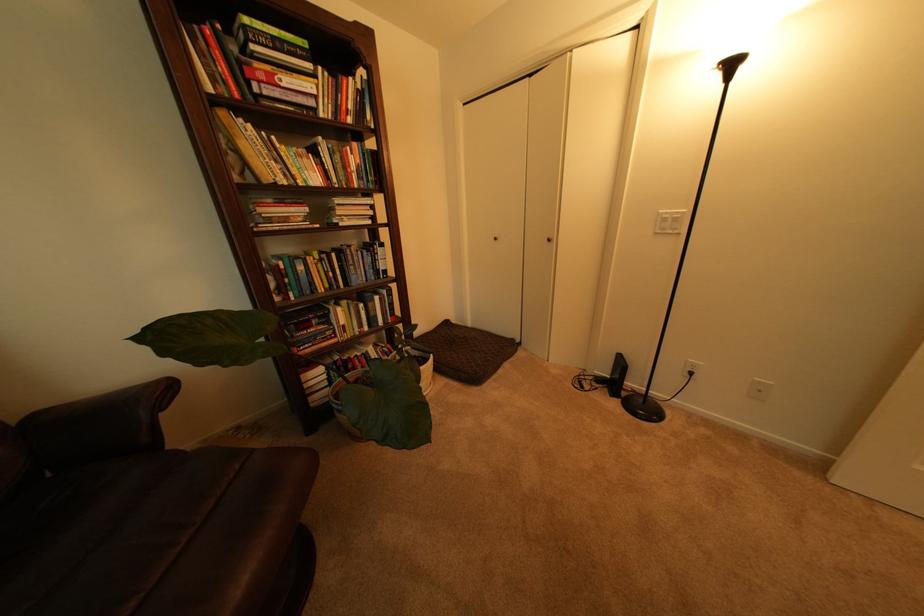
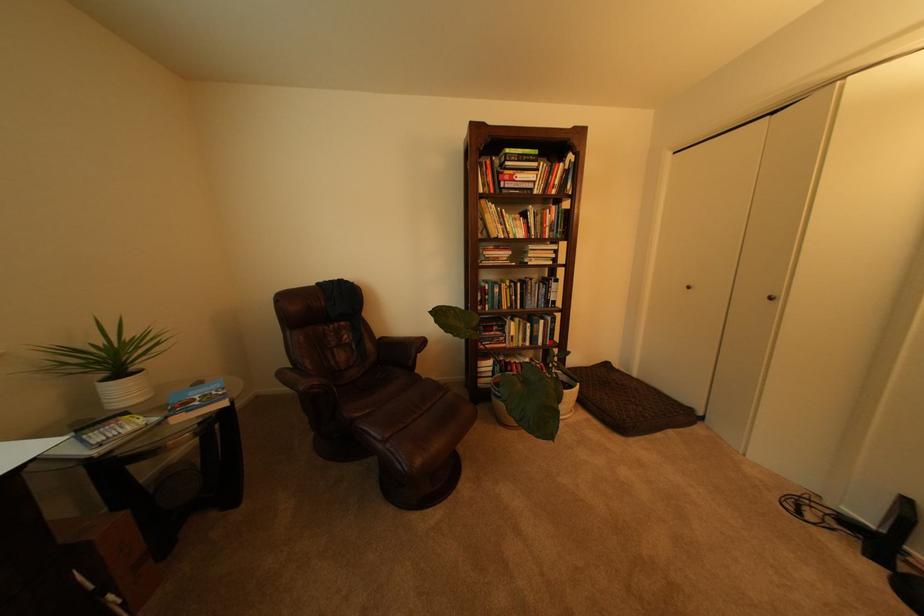
Locate, in the second image, the point that corresponds to (x=248, y=172) in the first image.

(492, 232)